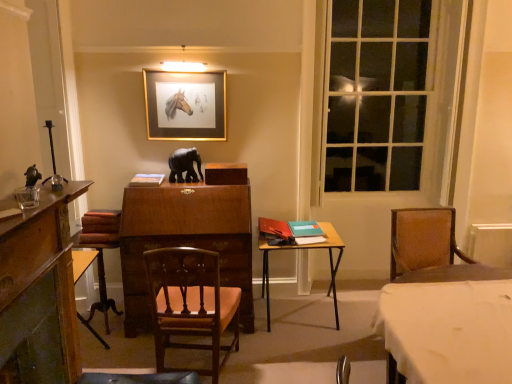
At what (x,y) coordinates should I click in order to perform the action: click on free space in front of wooden table at center, which appears as the first table when viewed from the back. Please return your answer as a coordinate pair (x, y). This screenshot has width=512, height=384. Looking at the image, I should click on (305, 357).